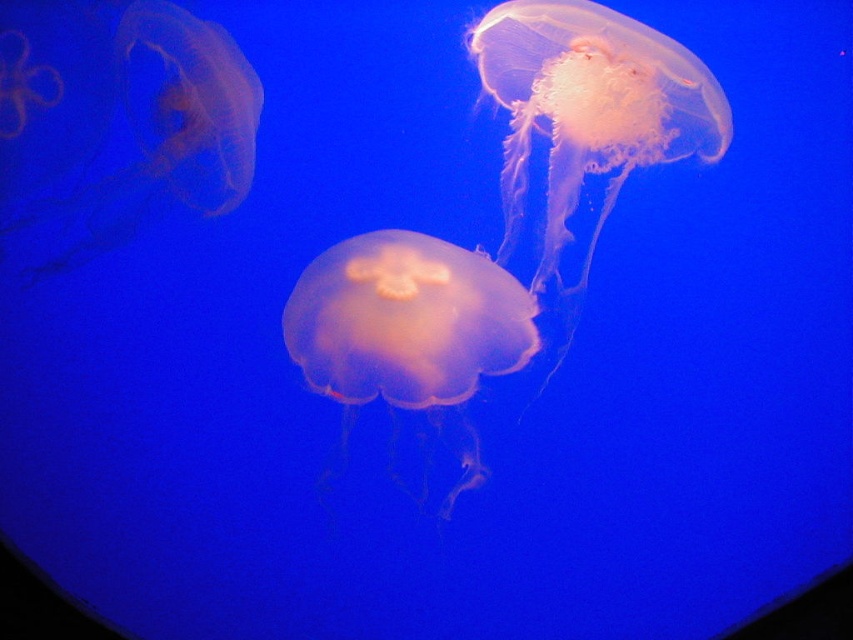
You are a marine biologist observing this underwater scene. You need to place a 30 cm long measuring tape between the translucent orange jellyfish at center and the translucent pink jellyfish at upper left. Will the tape be long enough to reach both ends?

The distance between the translucent orange jellyfish at center and the translucent pink jellyfish at upper left is 32.86 centimeters. Since the measuring tape is only 30 cm long, it will not be long enough to reach both ends.

You are a marine biologist observing an underwater scene. You need to locate the translucent pink jellyfish at center. What are its coordinates in the image?

The coordinates of the translucent pink jellyfish at center are at point [589,113].